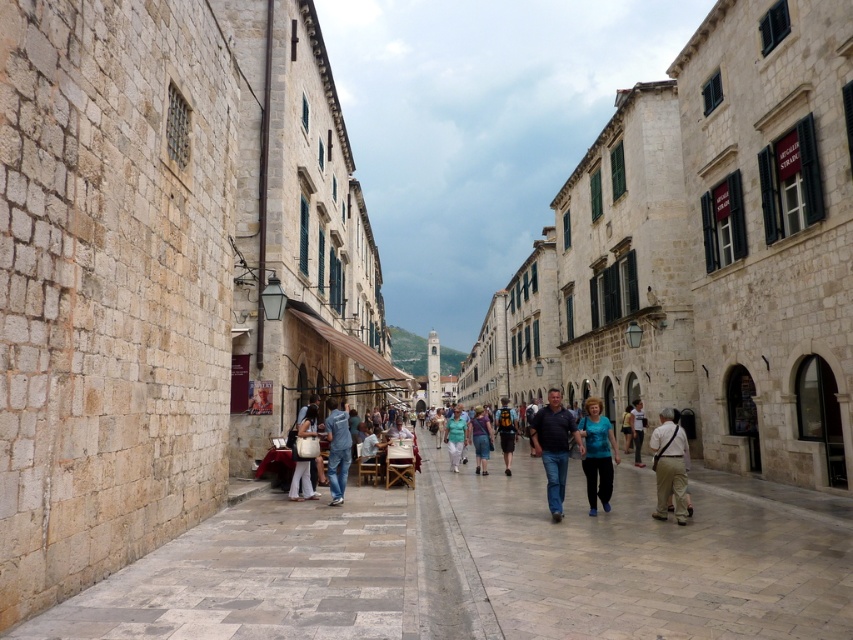
You are a photographer planning to capture a photo of the khaki cotton pants at center and the light blue fabric dress at center in the Dubrovnik Bell Tower background. Since you want to ensure both subjects are in focus, you need to know their relative sizes. Which one is smaller?

The khaki cotton pants at center has a smaller size compared to the light blue fabric dress at center, so the khaki cotton pants at center is smaller.

You are a tourist walking on the smooth stone pavement at center and want to place your light blue fabric dress at center on the ground. Can the dress fit entirely on the pavement?

The smooth stone pavement at center has a smaller size compared to light blue fabric dress at center, so the dress cannot fit entirely on the pavement.